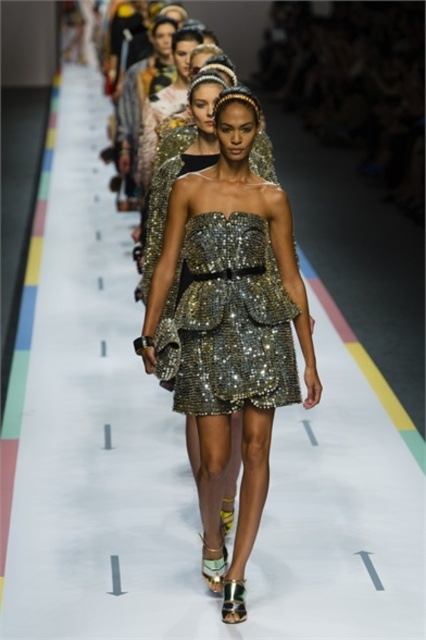
Question: Is sparkly metallic dress at center to the left of shiny sequined dress at center from the viewer's perspective?

Choices:
 (A) yes
 (B) no

Answer: (A)

Question: Which object appears closest to the camera in this image?

Choices:
 (A) shiny sequined dress at center
 (B) sparkly metallic dress at center

Answer: (B)

Question: Among these points, which one is nearest to the camera?

Choices:
 (A) (184, 230)
 (B) (233, 246)

Answer: (B)

Question: Does sparkly metallic dress at center have a smaller size compared to shiny sequined dress at center?

Choices:
 (A) yes
 (B) no

Answer: (B)

Question: Does sparkly metallic dress at center come in front of shiny sequined dress at center?

Choices:
 (A) no
 (B) yes

Answer: (B)